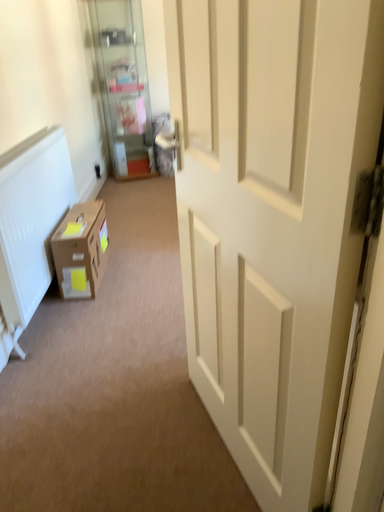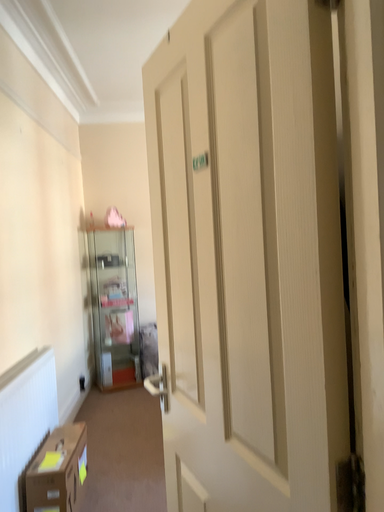
Question: Which way did the camera rotate in the video?

Choices:
 (A) rotated downward
 (B) rotated upward

Answer: (B)